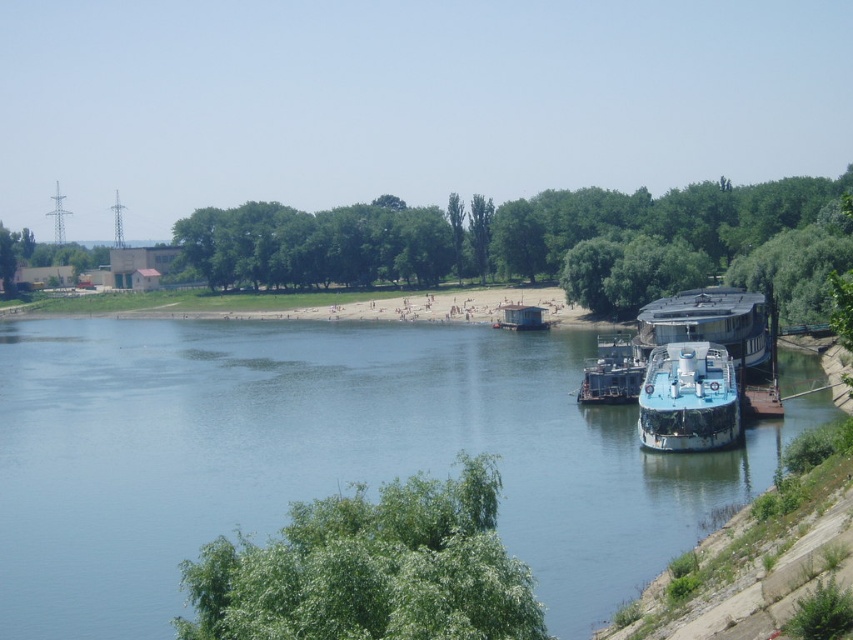
Question: Which of these objects is positioned farthest from the blue metallic boat at right?

Choices:
 (A) blue metallic houseboat at right
 (B) rusty metal barge at lower right

Answer: (B)

Question: Among these objects, which one is nearest to the camera?

Choices:
 (A) green leafy trees at center
 (B) blue metallic houseboat at right
 (C) green leafy tree at lower center
 (D) blue smooth water at center

Answer: (C)

Question: Is green leafy tree at lower center smaller than rusty metal barge at lower right?

Choices:
 (A) yes
 (B) no

Answer: (A)

Question: Which of the following is the farthest from the observer?

Choices:
 (A) green leafy trees at center
 (B) blue metallic boat at right
 (C) green leafy tree at lower center
 (D) rusty metal barge at lower right

Answer: (A)

Question: Does blue metallic houseboat at right have a smaller size compared to rusty metal barge at lower right?

Choices:
 (A) no
 (B) yes

Answer: (A)

Question: Considering the relative positions of green leafy tree at lower center and blue metallic boat at right in the image provided, where is green leafy tree at lower center located with respect to blue metallic boat at right?

Choices:
 (A) below
 (B) above

Answer: (A)